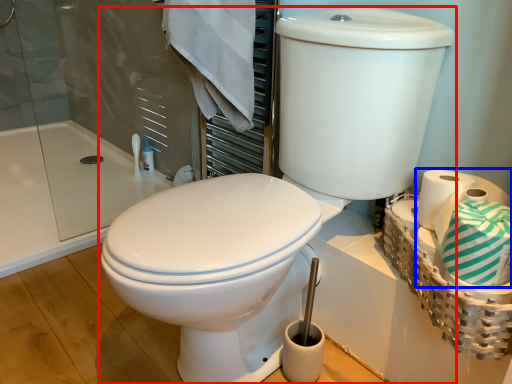
Question: Which object appears closest to the camera in this image, toilet (highlighted by a red box) or toilet paper (highlighted by a blue box)?

Choices:
 (A) toilet
 (B) toilet paper

Answer: (A)